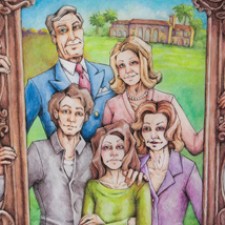
This screenshot has height=225, width=225. Find the location of `painting frame`. painting frame is located at coordinates 214,85.